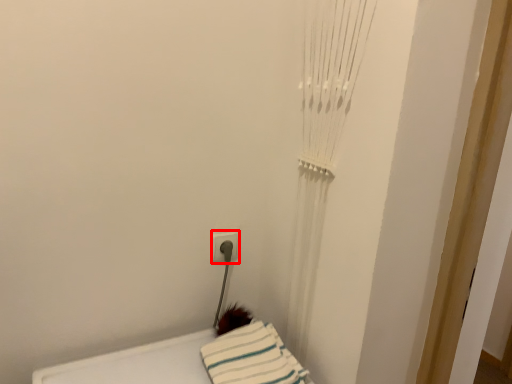
Question: From the image, what is the correct spatial relationship of electric outlet (annotated by the red box) in relation to sheet?

Choices:
 (A) left
 (B) right

Answer: (A)